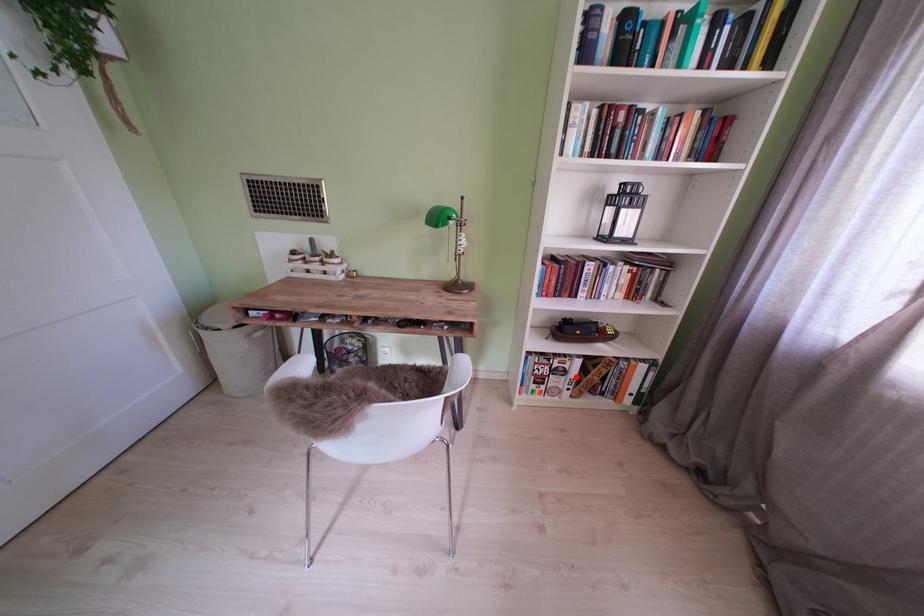
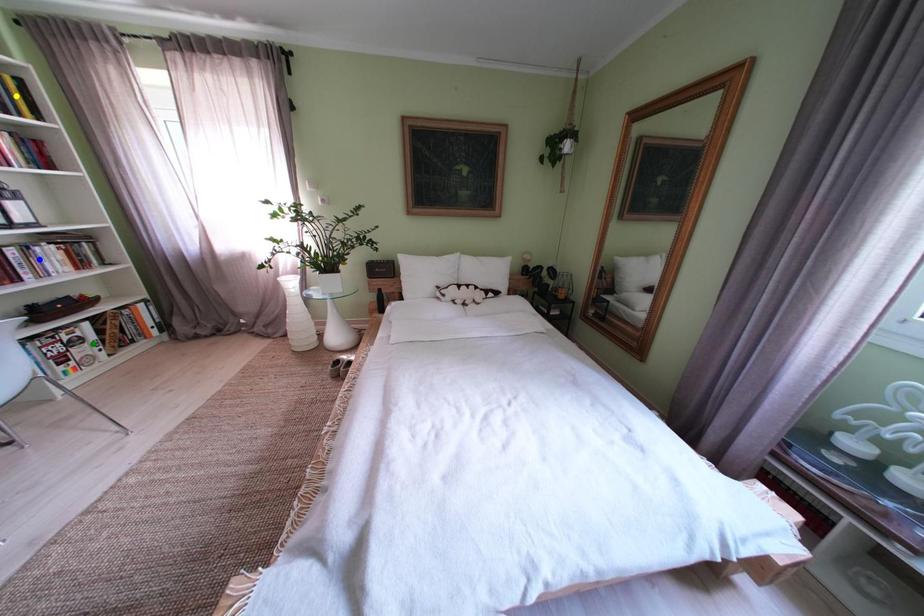
Question: I am providing you with two images of the same scene from different viewpoints. A red point is marked on the first image. You are given multiple points on the second image. In image 2, which mark is for the same physical point as the one in image 1?

Choices:
 (A) blue point
 (B) yellow point
 (C) green point

Answer: (C)